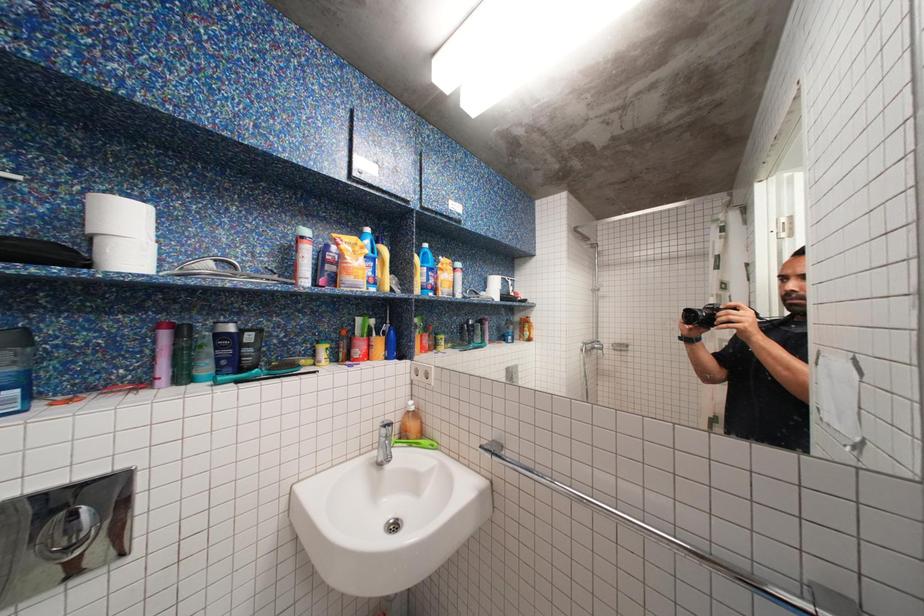
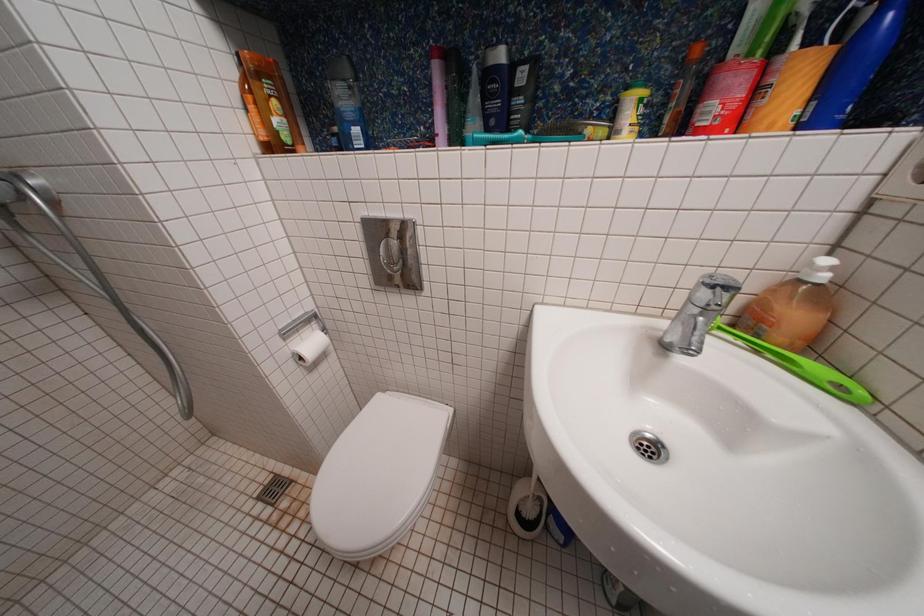
How did the camera likely rotate?

The camera's rotation is toward left-down.